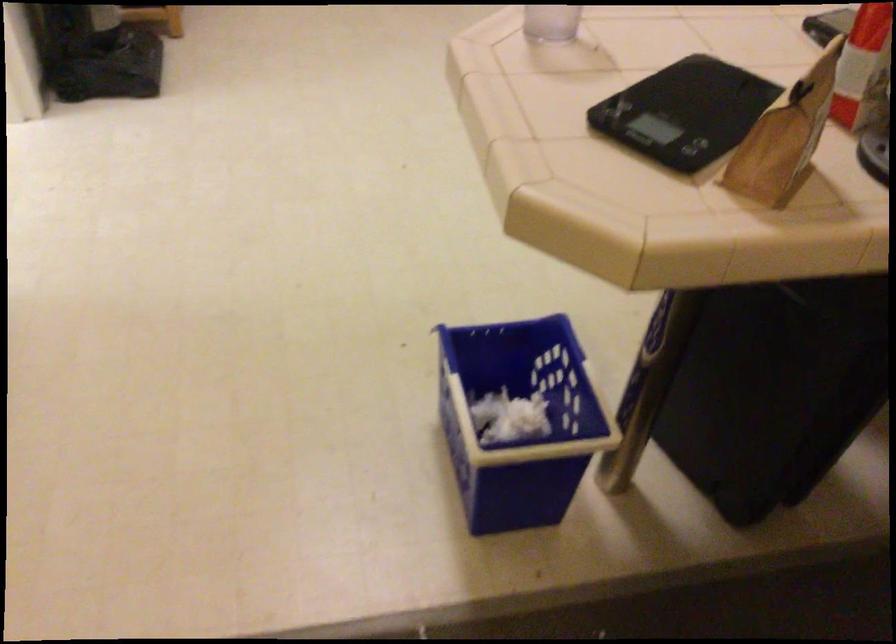
Locate an element on the screen. The width and height of the screenshot is (896, 644). brown paper bag is located at coordinates (785, 137).